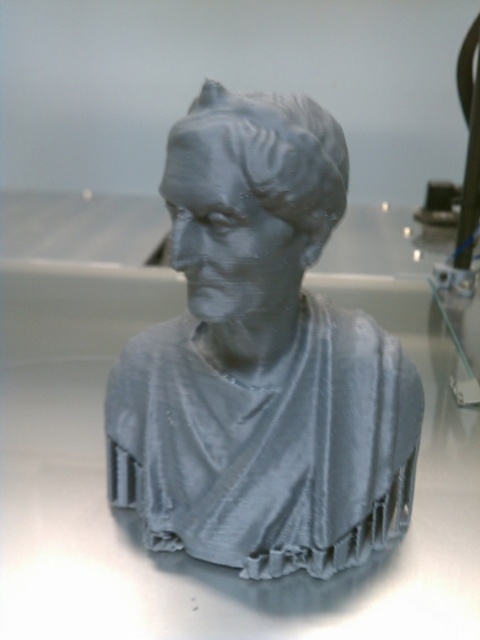
Can you confirm if gray matte bust at center is taller than matte gray bust at center?

Correct, gray matte bust at center is much taller as matte gray bust at center.

Does gray matte bust at center lie behind matte gray bust at center?

Yes, gray matte bust at center is behind matte gray bust at center.

Which is behind, point (207, 93) or point (285, 188)?

The point (207, 93) is more distant.

Locate an element on the screen. gray matte bust at center is located at coordinates (261, 360).